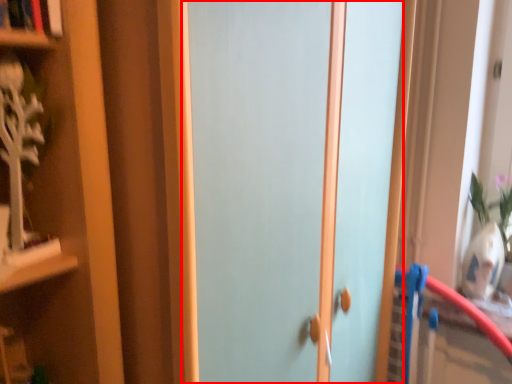
Question: Considering the relative positions of door (annotated by the red box) and book in the image provided, where is door (annotated by the red box) located with respect to the staircase?

Choices:
 (A) left
 (B) right

Answer: (B)